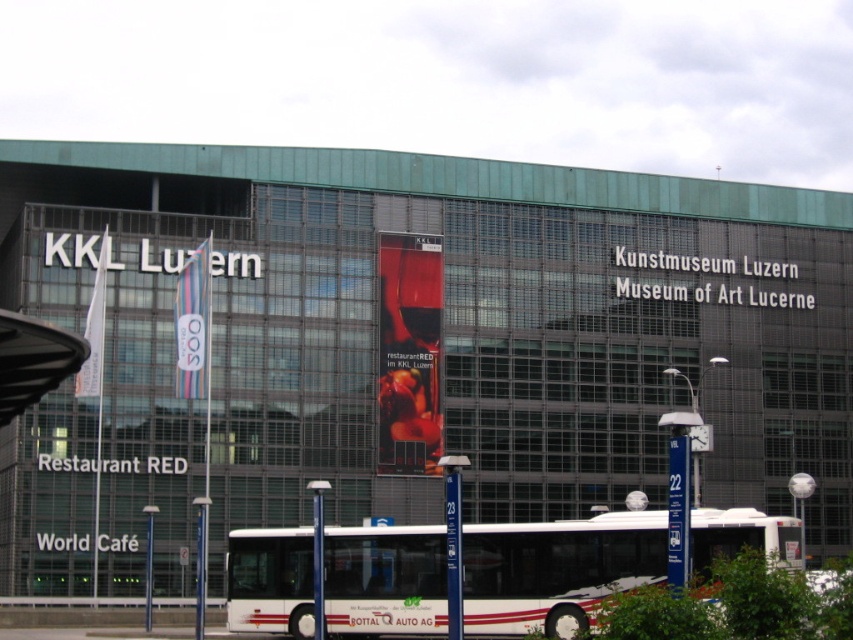
Between white metallic bus at center and matte glass billboard at center, which one has more height?

With more height is white metallic bus at center.

Is white metallic bus at center shorter than matte glass billboard at center?

In fact, white metallic bus at center may be taller than matte glass billboard at center.

Is point (431, 570) less distant than point (685, 440)?

No, it is behind (685, 440).

You are a GUI agent. You are given a task and a screenshot of the screen. Output one action in this format:
    pyautogui.click(x=<x>, y=<y>)
    Task: Click on the white metallic bus at center
    This screenshot has height=640, width=853.
    Given the screenshot: What is the action you would take?
    pyautogui.click(x=556, y=570)

Consider the image. Can you confirm if white metallic bus at center is thinner than matte glass banner at center?

No.

Between white metallic bus at center and matte glass banner at center, which one is positioned lower?

white metallic bus at center is lower down.

Describe the element at coordinates (556, 570) in the screenshot. I see `white metallic bus at center` at that location.

I want to click on white metallic bus at center, so click(556, 570).

This screenshot has height=640, width=853. What are the coordinates of `white metallic bus at center` in the screenshot? It's located at (556, 570).

Looking at this image, can you confirm if white metallic bus at center is thinner than white fabric flag at center?

Incorrect, white metallic bus at center's width is not less than white fabric flag at center's.

This screenshot has width=853, height=640. Identify the location of white metallic bus at center. (556, 570).